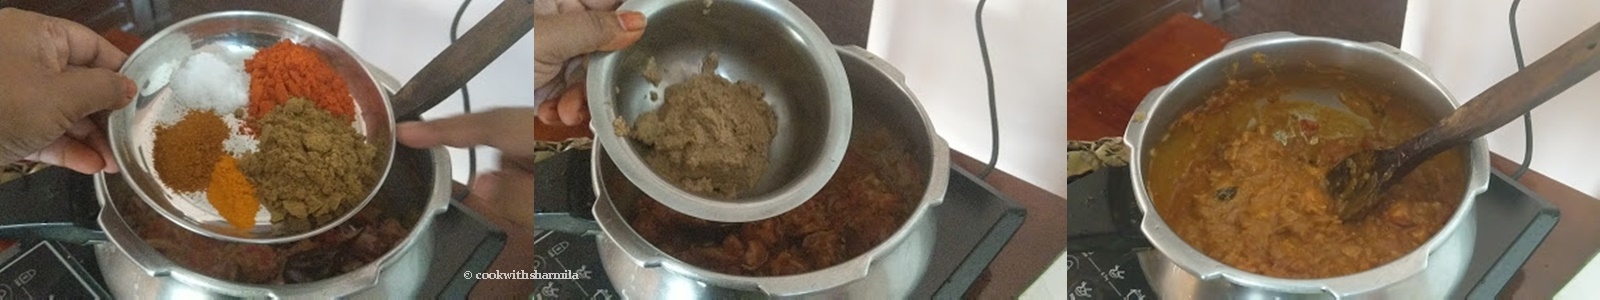
Image resolution: width=1600 pixels, height=300 pixels. Identify the location of wooden spoon. (1510, 101).